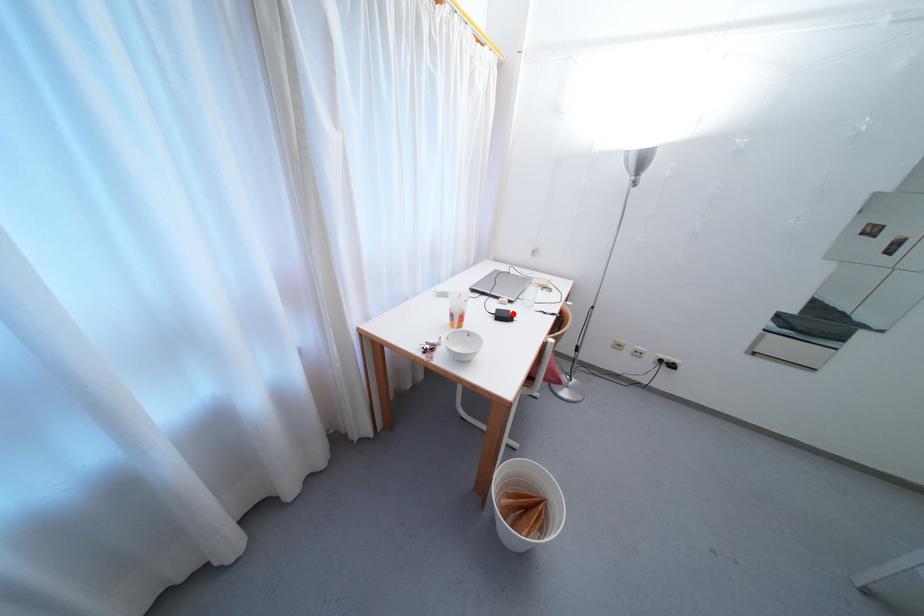
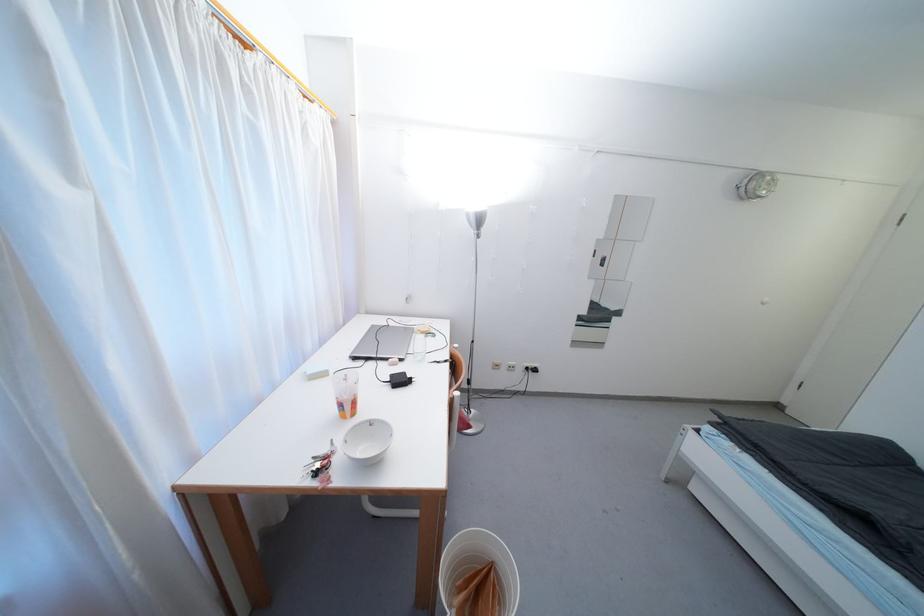
The point at the highlighted location is marked in the first image. Where is the corresponding point in the second image?

(408, 376)